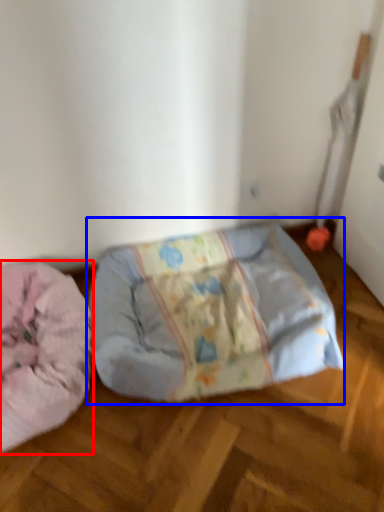
Question: Which point is further to the camera, dog bed (highlighted by a red box) or furniture (highlighted by a blue box)?

Choices:
 (A) dog bed
 (B) furniture

Answer: (B)